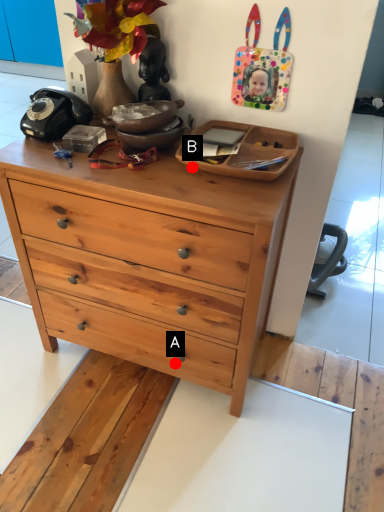
Question: Two points are circled on the image, labeled by A and B beside each circle. Which point is closer to the camera?

Choices:
 (A) A is closer
 (B) B is closer

Answer: (B)